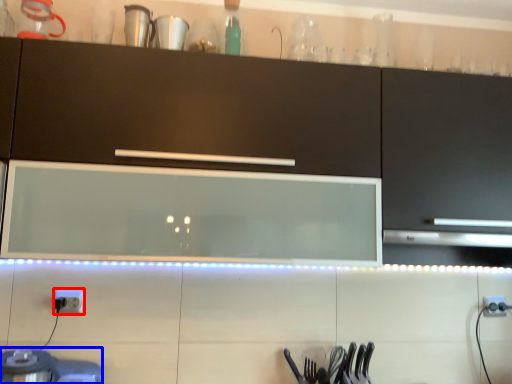
Question: Which object is closer to the camera taking this photo, electric outlet (highlighted by a red box) or appliance (highlighted by a blue box)?

Choices:
 (A) electric outlet
 (B) appliance

Answer: (B)